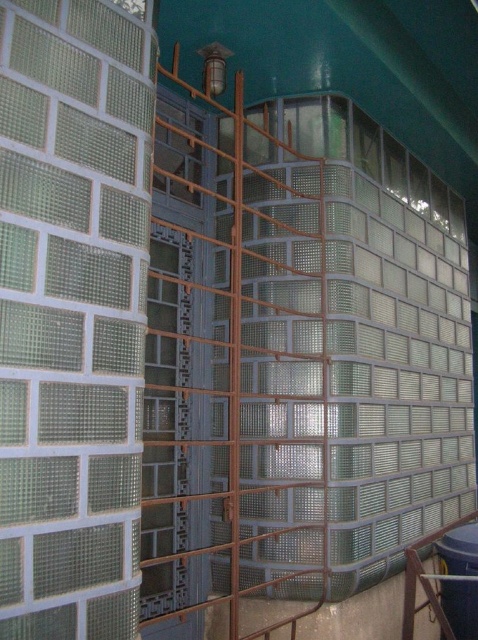
Question: Is brown metal cage at center above blue plastic water tank at lower right?

Choices:
 (A) yes
 (B) no

Answer: (A)

Question: Is brown metal cage at center smaller than blue plastic water tank at lower right?

Choices:
 (A) no
 (B) yes

Answer: (A)

Question: Which point is farther from the camera taking this photo?

Choices:
 (A) (457, 538)
 (B) (279, 220)

Answer: (A)

Question: Which of the following is the farthest from the observer?

Choices:
 (A) blue plastic water tank at lower right
 (B) brown metal cage at center

Answer: (A)

Question: Is brown metal cage at center bigger than blue plastic water tank at lower right?

Choices:
 (A) yes
 (B) no

Answer: (A)